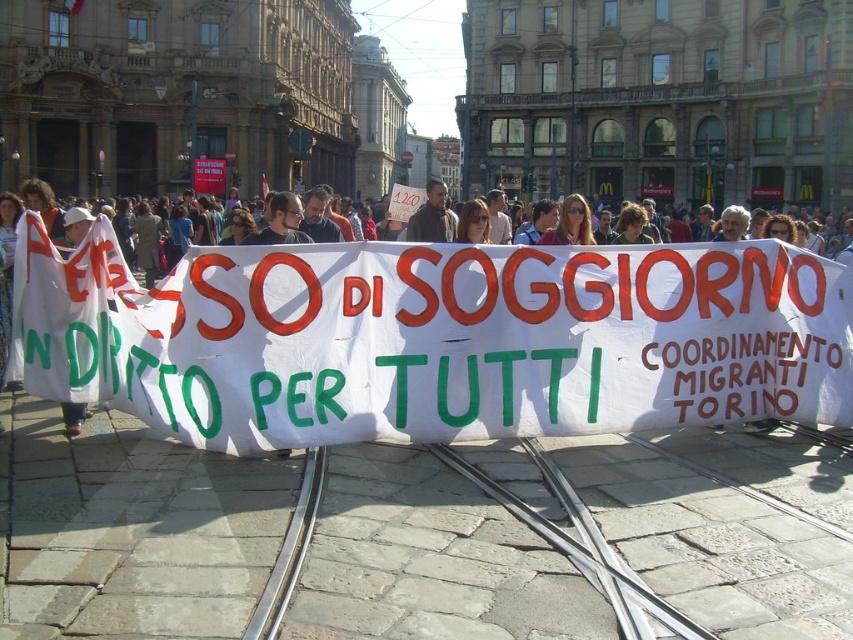
Is white paper banner at center taller than matte black sign at center?

Correct, white paper banner at center is much taller as matte black sign at center.

Does white paper banner at center lie behind matte black sign at center?

No.

Which is behind, point (769, 259) or point (415, 236)?

The point (415, 236) is behind.

This screenshot has width=853, height=640. I want to click on white paper banner at center, so click(433, 339).